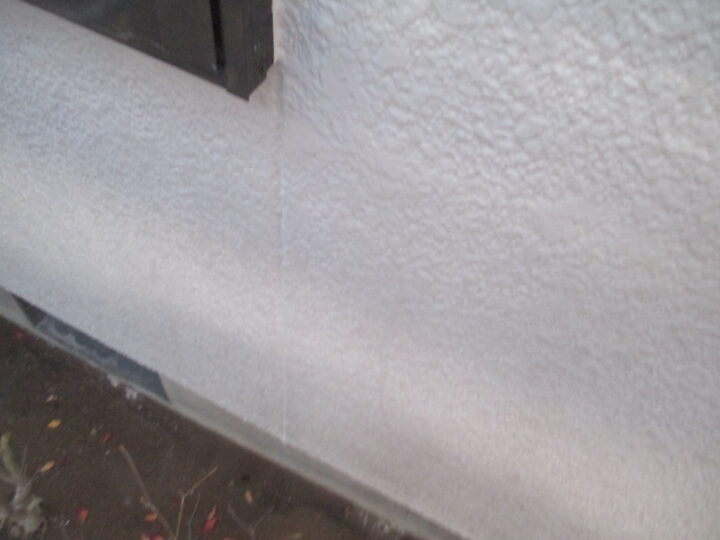
The image size is (720, 540). I want to click on caulk around window frame, so click(x=273, y=18).